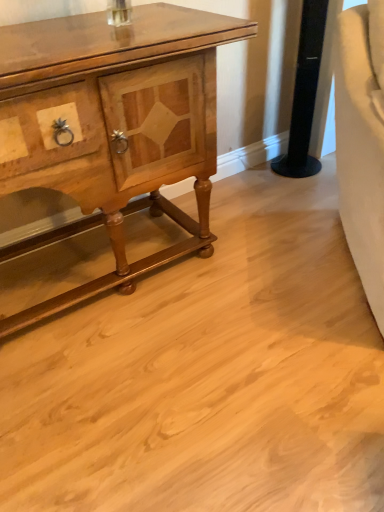
You are a GUI agent. You are given a task and a screenshot of the screen. Output one action in this format:
    pyautogui.click(x=<x>, y=<y>)
    Task: Click on the free spot in front of black glossy speaker at upper right
    The height and width of the screenshot is (512, 384).
    Given the screenshot: What is the action you would take?
    pyautogui.click(x=300, y=190)